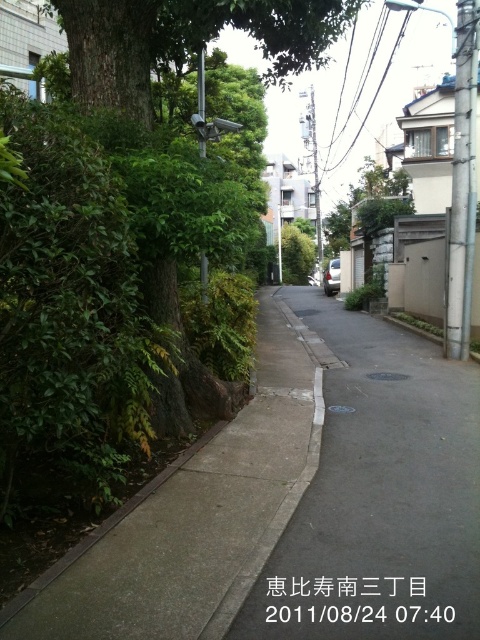
Question: Which point is farther to the camera?

Choices:
 (A) (407, 188)
 (B) (389, 394)

Answer: (A)

Question: Is gray asphalt pavement at center to the right of green leafy tree at center from the viewer's perspective?

Choices:
 (A) no
 (B) yes

Answer: (A)

Question: Is gray asphalt pavement at center behind green leafy tree at center?

Choices:
 (A) yes
 (B) no

Answer: (B)

Question: Does gray asphalt pavement at center have a smaller size compared to green leafy tree at center?

Choices:
 (A) no
 (B) yes

Answer: (B)